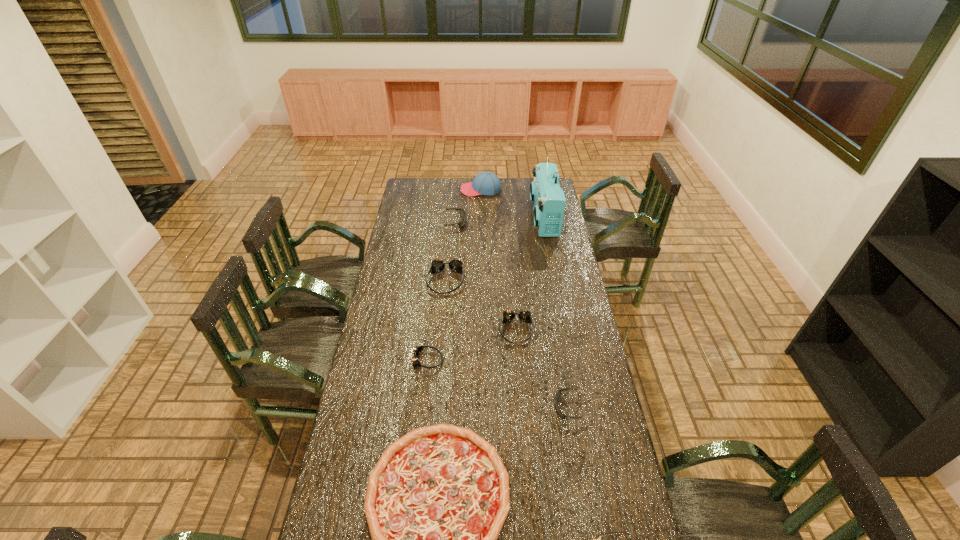
Image resolution: width=960 pixels, height=540 pixels. In order to click on the smallest bronze goggles in this screenshot , I will do `click(417, 349)`.

Locate an element on the screen. the nearest bronze goggles is located at coordinates (417, 349).

Locate an element on the screen. The image size is (960, 540). the nearer black goggles is located at coordinates pos(558,394).

You are a GUI agent. You are given a task and a screenshot of the screen. Output one action in this format:
    pyautogui.click(x=<x>, y=<y>)
    Task: Click on the seventh farthest object
    The width and height of the screenshot is (960, 540).
    Given the screenshot: What is the action you would take?
    pyautogui.click(x=558, y=394)

Identify the location of free space located 0.090m on the front-facing side of the blue radio receiver. This screenshot has height=540, width=960. (516, 218).

At what (x,y) coordinates should I click in order to perform the action: click on blank area located 0.140m on the front-facing side of the blue radio receiver. Please return your answer as a coordinate pair (x, y). The height and width of the screenshot is (540, 960). Looking at the image, I should click on (506, 218).

This screenshot has height=540, width=960. In order to click on free region located on the front-facing side of the blue radio receiver in this screenshot , I will do `click(499, 218)`.

Locate an element on the screen. vacant position located on the front-facing side of the blue baseball cap is located at coordinates (418, 190).

Find the location of `vacant space located on the front-facing side of the blue baseball cap`. vacant space located on the front-facing side of the blue baseball cap is located at coordinates (431, 190).

I want to click on vacant space situated on the front-facing side of the blue baseball cap, so click(x=408, y=190).